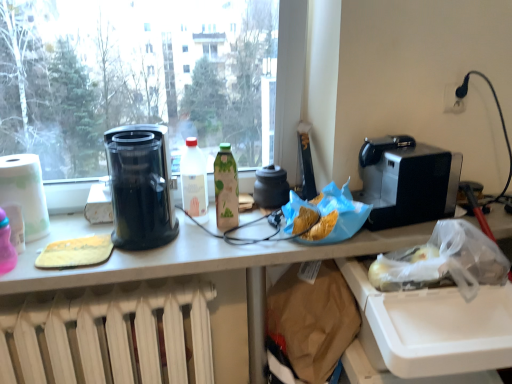
Question: Should I look upward or downward to see transparent glass window at upper left?

Choices:
 (A) down
 (B) up

Answer: (B)

Question: Which direction should I rotate to look at golden crispy chips at center, which is counted as the second food, starting from the left?

Choices:
 (A) right
 (B) left

Answer: (A)

Question: Is transparent plastic coffee maker at left outside white glossy bottle at center, the 1th bottle when ordered from left to right?

Choices:
 (A) yes
 (B) no

Answer: (A)

Question: Does transparent plastic coffee maker at left have a lesser width compared to white glossy bottle at center, the 1th bottle when ordered from left to right?

Choices:
 (A) yes
 (B) no

Answer: (B)

Question: Is white glossy bottle at center, the 1th bottle when ordered from left to right, surrounded by transparent plastic coffee maker at left?

Choices:
 (A) no
 (B) yes

Answer: (A)

Question: Does transparent plastic coffee maker at left appear on the right side of white glossy bottle at center, the second bottle when ordered from right to left?

Choices:
 (A) yes
 (B) no

Answer: (B)

Question: Is transparent plastic coffee maker at left positioned in front of white glossy bottle at center, the 1th bottle when ordered from left to right?

Choices:
 (A) no
 (B) yes

Answer: (B)

Question: Is transparent plastic coffee maker at left wider than white glossy bottle at center, the 1th bottle when ordered from left to right?

Choices:
 (A) yes
 (B) no

Answer: (A)

Question: Considering the relative sizes of satin black coffee machine at right and white glossy bottle at center, the second bottle when ordered from right to left, in the image provided, is satin black coffee machine at right thinner than white glossy bottle at center, the second bottle when ordered from right to left,?

Choices:
 (A) no
 (B) yes

Answer: (A)

Question: Does satin black coffee machine at right have a greater height compared to white glossy bottle at center, the second bottle when ordered from right to left?

Choices:
 (A) yes
 (B) no

Answer: (B)

Question: Can we say satin black coffee machine at right lies outside white glossy bottle at center, the second bottle when ordered from right to left?

Choices:
 (A) yes
 (B) no

Answer: (A)

Question: Does satin black coffee machine at right appear on the right side of white glossy bottle at center, the second bottle when ordered from right to left?

Choices:
 (A) yes
 (B) no

Answer: (A)

Question: Is white glossy bottle at center, the 1th bottle when ordered from left to right, inside satin black coffee machine at right?

Choices:
 (A) yes
 (B) no

Answer: (B)

Question: Is satin black coffee machine at right positioned behind white glossy bottle at center, the second bottle when ordered from right to left?

Choices:
 (A) yes
 (B) no

Answer: (B)

Question: Does white paper towel at left appear on the right side of satin black coffee machine at right?

Choices:
 (A) yes
 (B) no

Answer: (B)